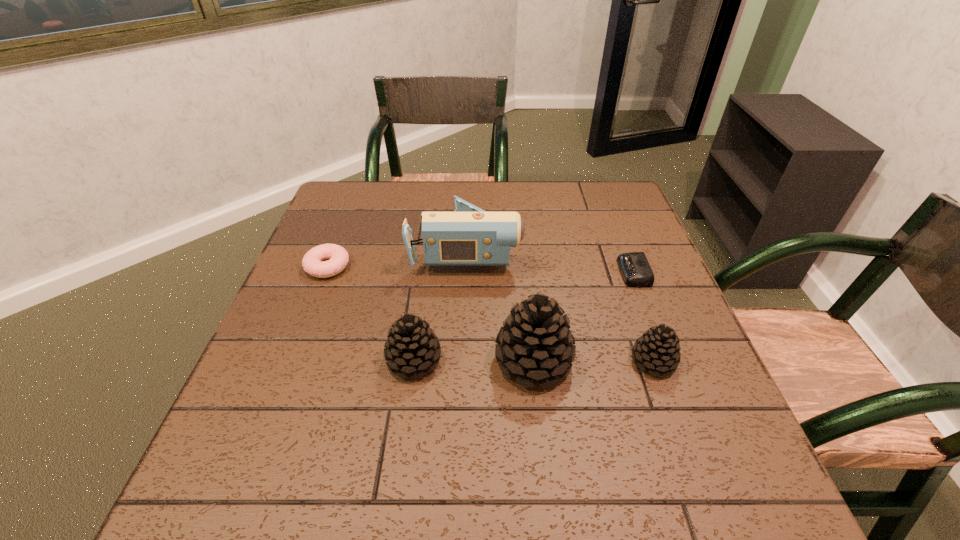
Where is `vacant region located 0.230m at the narrow end of the tallest pinecone`? The image size is (960, 540). vacant region located 0.230m at the narrow end of the tallest pinecone is located at coordinates (684, 360).

Identify the location of free space located at the narrow end of the shortest pinecone. (509, 361).

Locate an element on the screen. The height and width of the screenshot is (540, 960). vacant area situated at the narrow end of the shortest pinecone is located at coordinates (582, 361).

Where is `free location located at the narrow end of the shortest pinecone`? The height and width of the screenshot is (540, 960). free location located at the narrow end of the shortest pinecone is located at coordinates (563, 361).

The height and width of the screenshot is (540, 960). Identify the location of vacant space located 0.260m on the display of the alarm clock. (516, 272).

This screenshot has height=540, width=960. I want to click on free spot located on the display of the alarm clock, so click(519, 272).

Locate an element on the screen. The height and width of the screenshot is (540, 960). free point located on the display of the alarm clock is located at coordinates (576, 272).

Image resolution: width=960 pixels, height=540 pixels. I want to click on free space located 0.230m on the side of the camcorder with the flip-out screen, so click(x=607, y=249).

Image resolution: width=960 pixels, height=540 pixels. I want to click on vacant area situated 0.330m on the right of the fifth tallest object, so click(x=480, y=267).

Locate an element on the screen. object that is at the far edge is located at coordinates (469, 236).